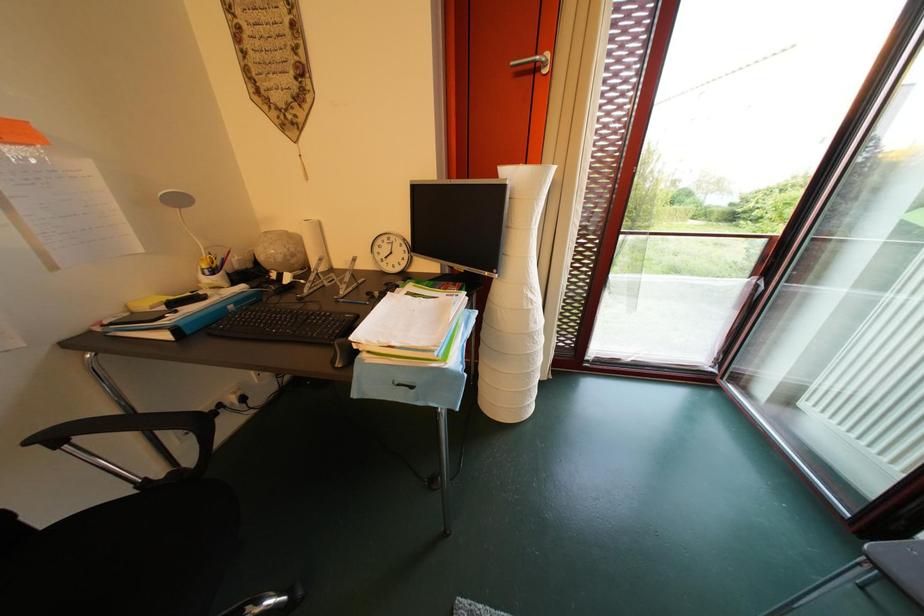
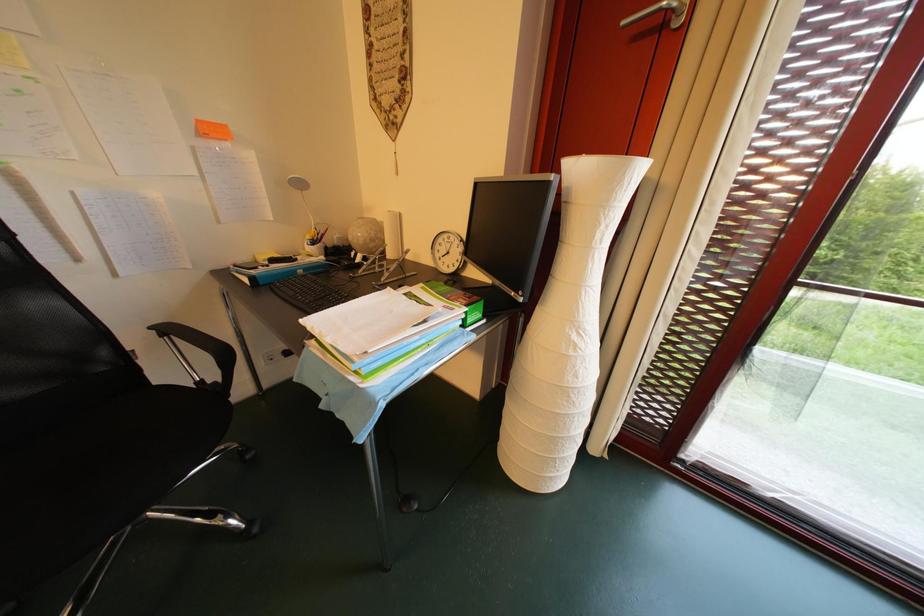
In a continuous first-person perspective shot, in which direction is the camera moving?

The cameraman moved toward right, forward.